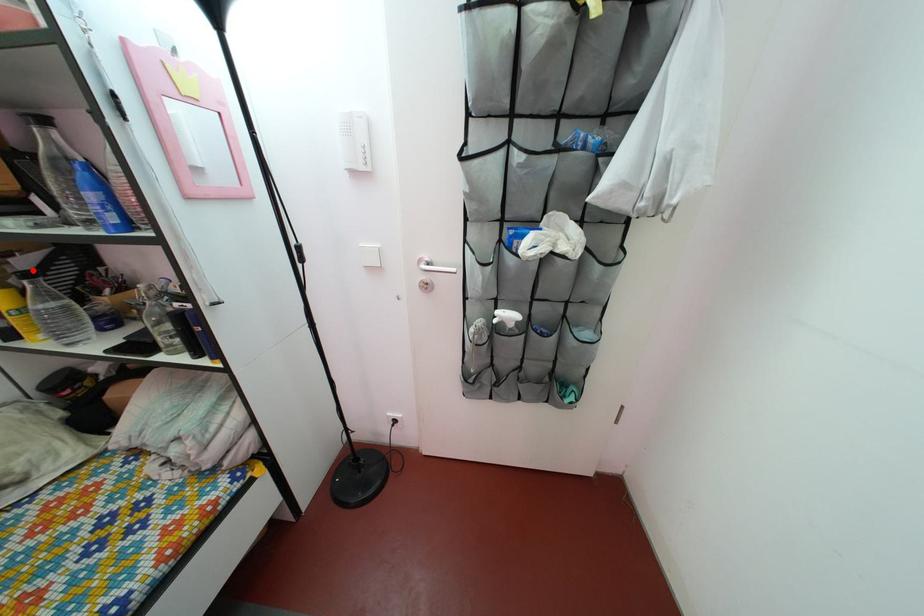
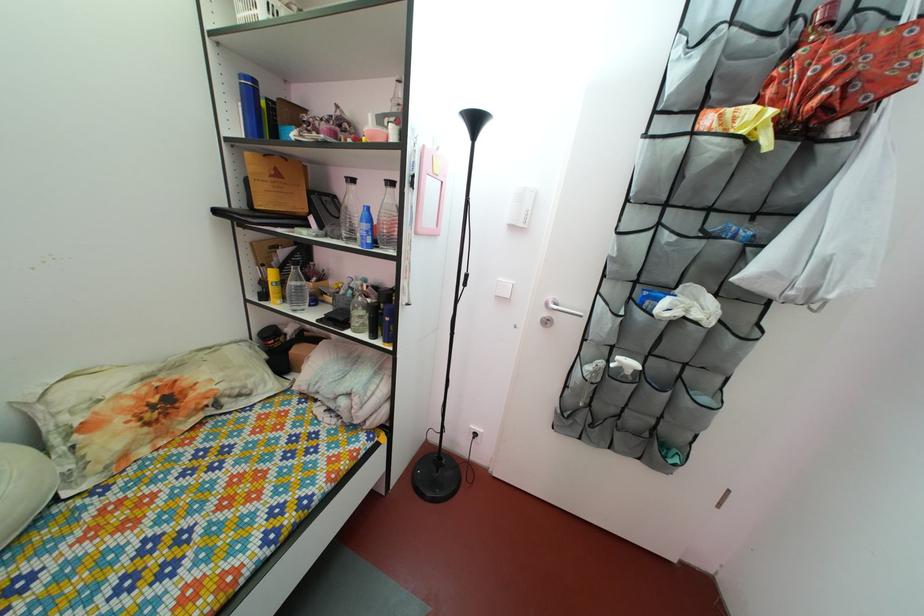
Question: I am providing you with two images of the same scene from different viewpoints. A red point is shown in image1. For the corresponding object point in image2, is it positioned nearer or farther from the camera?

Choices:
 (A) Nearer
 (B) Farther

Answer: (A)